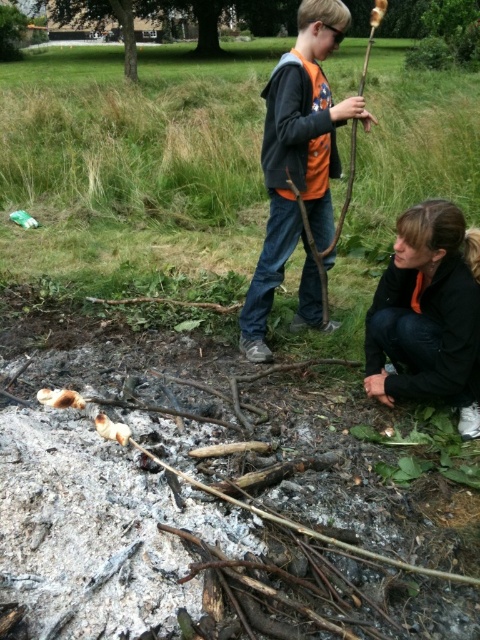
Is point (271, 132) farther from viewer compared to point (475, 288)?

That is True.

Image resolution: width=480 pixels, height=640 pixels. In order to click on orange fabric shirt at center in this screenshot , I will do `click(299, 170)`.